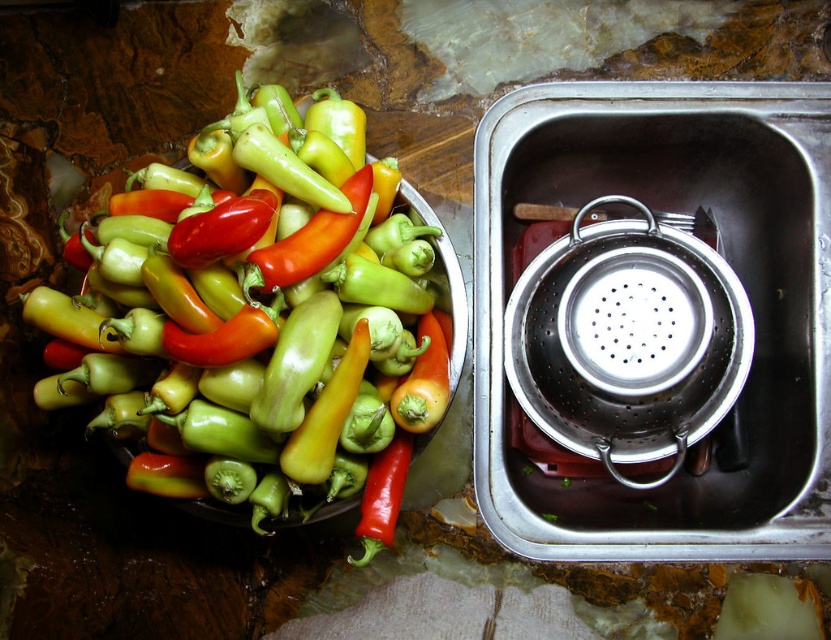
Question: Among these objects, which one is farthest from the camera?

Choices:
 (A) stainless steel colander at right
 (B) glossy green bell pepper at upper left
 (C) silver metallic strainer at right

Answer: (A)

Question: Is glossy green bell pepper at upper left behind silver metallic strainer at right?

Choices:
 (A) no
 (B) yes

Answer: (A)

Question: Based on their relative distances, which object is nearer to the stainless steel colander at right?

Choices:
 (A) silver metallic strainer at right
 (B) glossy green bell pepper at upper left

Answer: (A)

Question: Is glossy green bell pepper at upper left smaller than silver metallic strainer at right?

Choices:
 (A) no
 (B) yes

Answer: (A)

Question: Is glossy green bell pepper at upper left further to the viewer compared to silver metallic strainer at right?

Choices:
 (A) yes
 (B) no

Answer: (B)

Question: Which point is closer to the camera?

Choices:
 (A) stainless steel colander at right
 (B) glossy green bell pepper at upper left

Answer: (B)